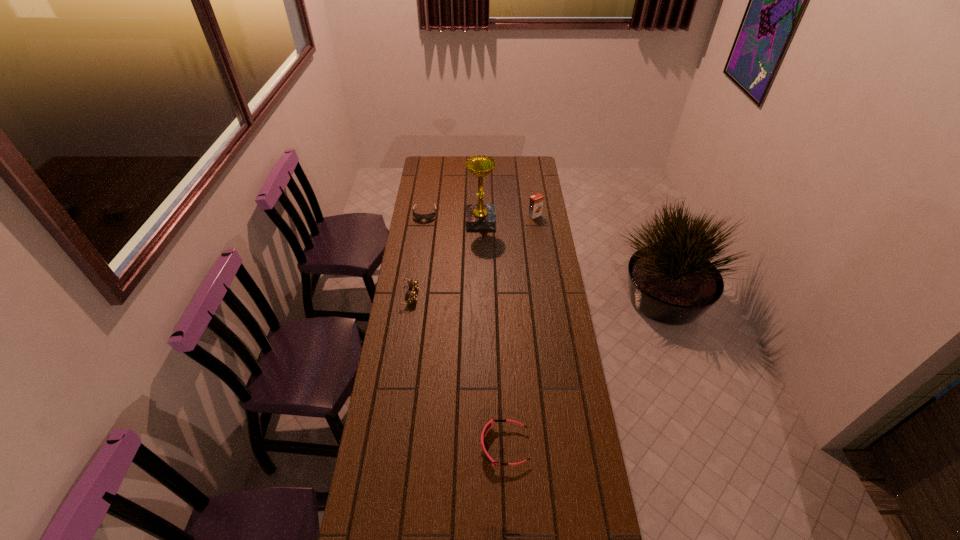
In the image, there is a desktop. At what (x,y) coordinates should I click in order to perform the action: click on vacant space at the right edge. Please return your answer as a coordinate pair (x, y). Looking at the image, I should click on (531, 188).

The height and width of the screenshot is (540, 960). In order to click on vacant space at the far left corner of the desktop in this screenshot , I will do `click(438, 158)`.

Find the location of a particular element. free space between the farthest goggles and the nearest object is located at coordinates (465, 330).

The image size is (960, 540). Identify the location of empty space that is in between the second nearest object and the fourth shortest object. (472, 255).

Locate an element on the screen. vacant space that's between the award and the orange juice is located at coordinates (508, 218).

The height and width of the screenshot is (540, 960). Identify the location of unoccupied position between the nearest object and the second tallest object. point(519,330).

This screenshot has height=540, width=960. What are the coordinates of `vacant point located between the shortest object and the second nearest goggles` in the screenshot? It's located at (418, 255).

Identify the location of vacant space in between the fourth farthest object and the tallest object. The image size is (960, 540). (445, 258).

I want to click on vacant point located between the second nearest goggles and the farthest goggles, so click(x=418, y=255).

This screenshot has width=960, height=540. In order to click on empty location between the second farthest goggles and the shortest object in this screenshot , I will do `click(418, 255)`.